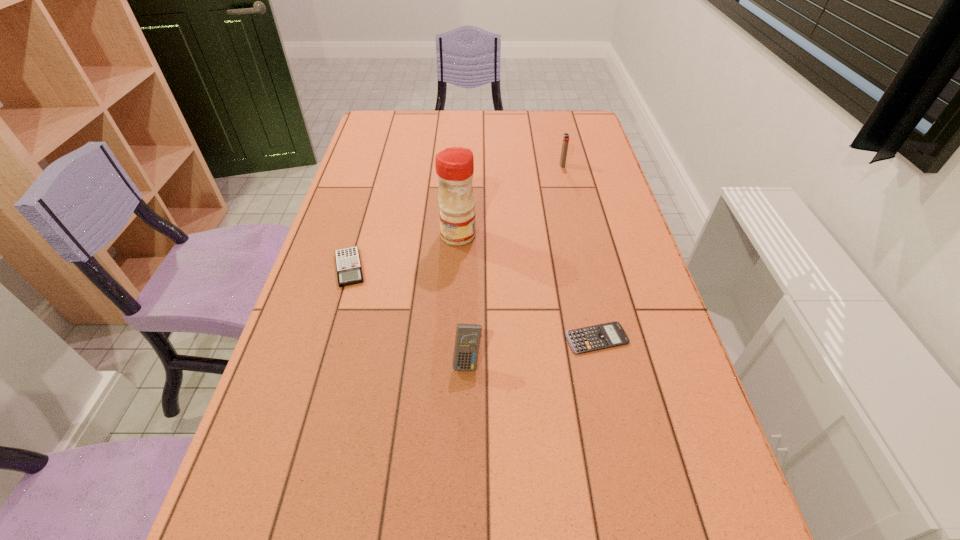
Choose which calculator is the nearest neighbor to the second calculator from right to left. Please provide its 2D coordinates. Your answer should be formatted as a tuple, i.e. [(x, y)], where the tuple contains the x and y coordinates of a point satisfying the conditions above.

[(592, 338)]

Select which calculator is the closest to the condiment. Please provide its 2D coordinates. Your answer should be formatted as a tuple, i.e. [(x, y)], where the tuple contains the x and y coordinates of a point satisfying the conditions above.

[(348, 264)]

You are a GUI agent. You are given a task and a screenshot of the screen. Output one action in this format:
    pyautogui.click(x=<x>, y=<y>)
    Task: Click on the vacant space that satisfies the following two spatial constraints: 1. on the front side of the shortest calculator; 2. on the left side of the tallest object
    The width and height of the screenshot is (960, 540).
    Given the screenshot: What is the action you would take?
    pyautogui.click(x=453, y=339)

At what (x,y) coordinates should I click in order to perform the action: click on vacant point that satisfies the following two spatial constraints: 1. on the front side of the second tallest calculator; 2. on the right side of the rightmost calculator. Please return your answer as a coordinate pair (x, y). Image resolution: width=960 pixels, height=540 pixels. Looking at the image, I should click on [329, 339].

Locate an element on the screen. This screenshot has height=540, width=960. free space that satisfies the following two spatial constraints: 1. on the back side of the farthest object; 2. on the right side of the leftmost object is located at coordinates (379, 165).